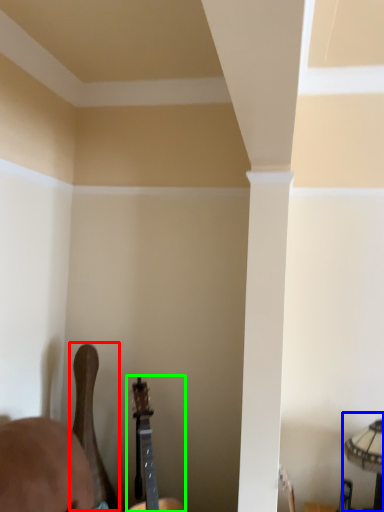
Question: Which object is the farthest from guitar (highlighted by a red box)? Choose among these: lamp (highlighted by a blue box) or guitar (highlighted by a green box).

Choices:
 (A) lamp
 (B) guitar

Answer: (A)